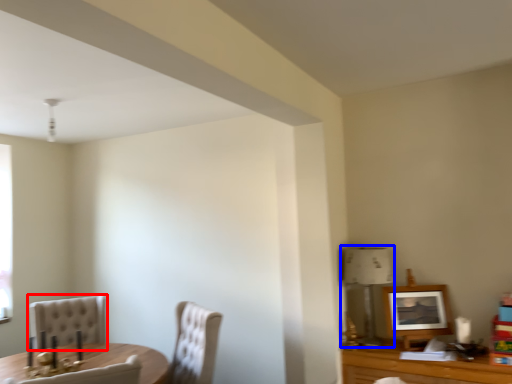
Question: Which point is further to the camera, chair (highlighted by a red box) or lamp (highlighted by a blue box)?

Choices:
 (A) chair
 (B) lamp

Answer: (A)